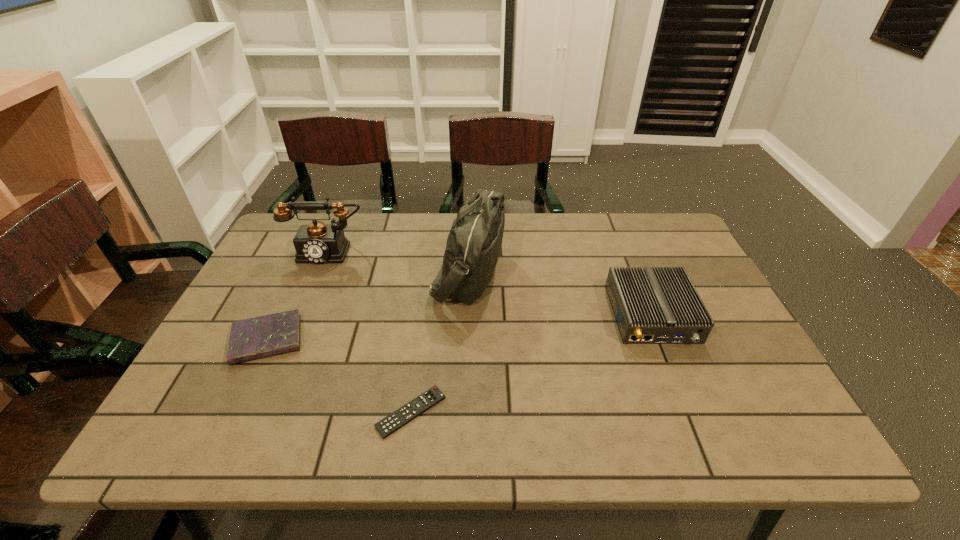
Where is `vacant region located on the right of the second shortest object`? The width and height of the screenshot is (960, 540). vacant region located on the right of the second shortest object is located at coordinates (366, 340).

This screenshot has height=540, width=960. In order to click on vacant region located 0.380m on the left of the shortest object in this screenshot , I will do `click(198, 412)`.

Where is `shoulder bag situated at the far edge`? shoulder bag situated at the far edge is located at coordinates (473, 247).

Where is `telephone that is at the far edge`? This screenshot has width=960, height=540. telephone that is at the far edge is located at coordinates (317, 243).

Find the location of a particular element. object that is positioned at the near edge is located at coordinates (402, 416).

In order to click on telephone present at the left edge in this screenshot , I will do `click(317, 243)`.

You are a GUI agent. You are given a task and a screenshot of the screen. Output one action in this format:
    pyautogui.click(x=<x>, y=<y>)
    Task: Click on the diary present at the left edge
    
    Given the screenshot: What is the action you would take?
    pyautogui.click(x=255, y=338)

Identify the location of object located at the right edge. (651, 305).

Find the location of a particular element. This screenshot has width=960, height=540. object that is positioned at the far left corner is located at coordinates (317, 243).

At what (x,y) coordinates should I click in order to perform the action: click on free location at the far edge of the desktop. Please return your answer as a coordinate pair (x, y). Looking at the image, I should click on (627, 238).